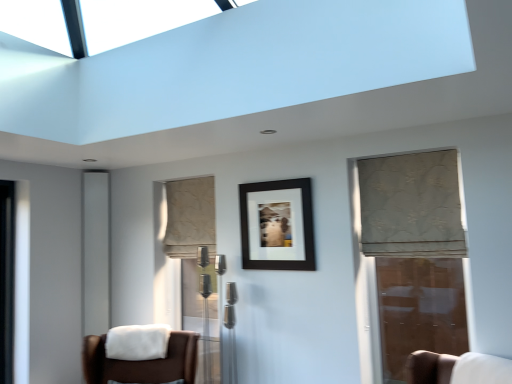
The height and width of the screenshot is (384, 512). What do you see at coordinates (190, 217) in the screenshot?
I see `beige textured curtain at center, arranged as the second curtain when viewed from the right` at bounding box center [190, 217].

I want to click on beige textured curtain at center, the 2th curtain when ordered from front to back, so click(190, 217).

Locate an element on the screen. white soft fabric at lower left is located at coordinates (137, 342).

Based on their positions, is white fabric chair at lower right, the first chair positioned from the right, located to the left or right of beige floral fabric curtain at right, arranged as the 1th curtain when viewed from the front?

white fabric chair at lower right, the first chair positioned from the right, is to the right of beige floral fabric curtain at right, arranged as the 1th curtain when viewed from the front.

Which object is wider, white fabric chair at lower right, which is counted as the 2th chair, starting from the left, or beige floral fabric curtain at right, positioned as the first curtain in right-to-left order?

With larger width is beige floral fabric curtain at right, positioned as the first curtain in right-to-left order.

Considering the positions of points (434, 364) and (422, 243), is point (434, 364) closer to camera compared to point (422, 243)?

Yes, it is in front of point (422, 243).

From their relative heights in the image, would you say white fabric chair at lower right, which is counted as the 2th chair, starting from the left, is taller or shorter than beige floral fabric curtain at right, arranged as the 1th curtain when viewed from the front?

In the image, white fabric chair at lower right, which is counted as the 2th chair, starting from the left, appears to be shorter than beige floral fabric curtain at right, arranged as the 1th curtain when viewed from the front.

Is white soft fabric at lower left at the right side of beige floral fabric curtain at right, positioned as the first curtain in right-to-left order?

Incorrect, white soft fabric at lower left is not on the right side of beige floral fabric curtain at right, positioned as the first curtain in right-to-left order.

Consider the image. Can you confirm if white soft fabric at lower left is thinner than beige floral fabric curtain at right, the 2th curtain when ordered from back to front?

Yes, white soft fabric at lower left is thinner than beige floral fabric curtain at right, the 2th curtain when ordered from back to front.

From the image's perspective, is white soft fabric at lower left below beige floral fabric curtain at right, the second curtain in the left-to-right sequence?

Yes, from the image's perspective, white soft fabric at lower left is below beige floral fabric curtain at right, the second curtain in the left-to-right sequence.

Are white soft fabric at lower left and beige floral fabric curtain at right, the second curtain in the left-to-right sequence, located far from each other?

Yes, white soft fabric at lower left and beige floral fabric curtain at right, the second curtain in the left-to-right sequence, are located far from each other.

Based on the photo, is beige floral fabric curtain at right, positioned as the first curtain in right-to-left order, to the left of gray matte screen door at left from the viewer's perspective?

Incorrect, beige floral fabric curtain at right, positioned as the first curtain in right-to-left order, is not on the left side of gray matte screen door at left.

Can you confirm if beige floral fabric curtain at right, positioned as the first curtain in right-to-left order, is smaller than gray matte screen door at left?

No, beige floral fabric curtain at right, positioned as the first curtain in right-to-left order, is not smaller than gray matte screen door at left.

In the scene shown: Measure the distance between beige floral fabric curtain at right, the second curtain in the left-to-right sequence, and gray matte screen door at left.

beige floral fabric curtain at right, the second curtain in the left-to-right sequence, and gray matte screen door at left are 7.42 feet apart from each other.

Who is shorter, black matte picture frame at center or gray matte screen door at left?

black matte picture frame at center is shorter.

From the image's perspective, is black matte picture frame at center positioned above or below gray matte screen door at left?

From the image's perspective, black matte picture frame at center appears above gray matte screen door at left.

Does black matte picture frame at center appear on the right side of gray matte screen door at left?

Indeed, black matte picture frame at center is positioned on the right side of gray matte screen door at left.

Are black matte picture frame at center and gray matte screen door at left making contact?

No, black matte picture frame at center is not in contact with gray matte screen door at left.

Would you say transparent glass door at right is inside or outside beige floral fabric curtain at right, the second curtain in the left-to-right sequence?

transparent glass door at right is not inside beige floral fabric curtain at right, the second curtain in the left-to-right sequence, it's outside.

You are a GUI agent. You are given a task and a screenshot of the screen. Output one action in this format:
    pyautogui.click(x=<x>, y=<y>)
    Task: Click on the curtain in front of the transparent glass door at right
    The image size is (512, 384).
    Given the screenshot: What is the action you would take?
    pyautogui.click(x=411, y=206)

From the image's perspective, is transparent glass door at right located above or below beige floral fabric curtain at right, positioned as the first curtain in right-to-left order?

Clearly, from the image's perspective, transparent glass door at right is below beige floral fabric curtain at right, positioned as the first curtain in right-to-left order.

Which of these two, transparent glass door at right or beige floral fabric curtain at right, positioned as the first curtain in right-to-left order, is bigger?

beige floral fabric curtain at right, positioned as the first curtain in right-to-left order, is bigger.

Are black matte picture frame at center and transparent glass door at right far apart?

Indeed, black matte picture frame at center is not near transparent glass door at right.

In the scene shown: From the image's perspective, is black matte picture frame at center located beneath transparent glass door at right?

Incorrect, from the image's perspective, black matte picture frame at center is higher than transparent glass door at right.

Based on the photo, is black matte picture frame at center looking in the opposite direction of transparent glass door at right?

black matte picture frame at center does not have its back to transparent glass door at right.

From a real-world perspective, is black matte picture frame at center above or below transparent glass door at right?

black matte picture frame at center is situated higher than transparent glass door at right in the real world.

Between beige textured curtain at center, the first curtain viewed from the left, and transparent glass door at right, which one has larger width?

Wider between the two is beige textured curtain at center, the first curtain viewed from the left.

Which object is closer to the camera, beige textured curtain at center, arranged as the second curtain when viewed from the right, or transparent glass door at right?

Positioned in front is transparent glass door at right.

From a real-world perspective, is beige textured curtain at center, the first curtain viewed from the left, on transparent glass door at right?

Correct, in the physical world, beige textured curtain at center, the first curtain viewed from the left, is higher than transparent glass door at right.

Considering the sizes of objects beige textured curtain at center, the 2th curtain when ordered from front to back, and transparent glass door at right in the image provided, who is bigger, beige textured curtain at center, the 2th curtain when ordered from front to back, or transparent glass door at right?

Bigger between the two is beige textured curtain at center, the 2th curtain when ordered from front to back.

Locate an element on the screen. The width and height of the screenshot is (512, 384). the 1st chair located beneath the beige floral fabric curtain at right, the 2th curtain when ordered from back to front (from a real-world perspective) is located at coordinates (457, 368).

From a real-world perspective, starting from the white soft fabric at lower left, which curtain is the 1st one vertically above it? Please provide its 2D coordinates.

[(411, 206)]

Looking at the image, which one is located closer to beige textured curtain at center, the 2th curtain when ordered from front to back, black matte picture frame at center or brown leather chair at lower left, placed as the 1th chair when sorted from left to right?

Among the two, black matte picture frame at center is located nearer to beige textured curtain at center, the 2th curtain when ordered from front to back.

Based on their spatial positions, is black matte picture frame at center or beige textured curtain at center, the 2th curtain when ordered from front to back, further from gray matte screen door at left?

black matte picture frame at center lies further to gray matte screen door at left than the other object.

Looking at the image, which one is located closer to beige floral fabric curtain at right, the second curtain in the left-to-right sequence, beige textured curtain at center, the 1th curtain viewed from the back, or white soft fabric at lower left?

beige textured curtain at center, the 1th curtain viewed from the back.

Estimate the real-world distances between objects in this image. Which object is closer to transparent glass door at right, gray matte screen door at left or beige floral fabric curtain at right, the 2th curtain when ordered from back to front?

beige floral fabric curtain at right, the 2th curtain when ordered from back to front.

From the image, which object appears to be nearer to white fabric chair at lower right, the first chair positioned from the right, white soft fabric at lower left or black matte picture frame at center?

Among the two, black matte picture frame at center is located nearer to white fabric chair at lower right, the first chair positioned from the right.

Estimate the real-world distances between objects in this image. Which object is further from transparent glass door at right, beige textured curtain at center, arranged as the second curtain when viewed from the right, or brown leather chair at lower left, which ranks as the 2th chair in right-to-left order?

brown leather chair at lower left, which ranks as the 2th chair in right-to-left order.

Estimate the real-world distances between objects in this image. Which object is further from white fabric chair at lower right, which is counted as the 2th chair, starting from the left, transparent glass door at right or brown leather chair at lower left, placed as the 1th chair when sorted from left to right?

The object further to white fabric chair at lower right, which is counted as the 2th chair, starting from the left, is transparent glass door at right.

Considering their positions, is beige floral fabric curtain at right, the second curtain in the left-to-right sequence, positioned further to black matte picture frame at center than gray matte screen door at left?

gray matte screen door at left lies further to black matte picture frame at center than the other object.

Find the location of a particular element. The height and width of the screenshot is (384, 512). picture frame situated between beige textured curtain at center, arranged as the second curtain when viewed from the right, and transparent glass door at right from left to right is located at coordinates (278, 225).

The width and height of the screenshot is (512, 384). I want to click on curtain between beige textured curtain at center, arranged as the second curtain when viewed from the right, and transparent glass door at right from left to right, so [x=411, y=206].

The height and width of the screenshot is (384, 512). I want to click on picture frame located between white soft fabric at lower left and beige floral fabric curtain at right, positioned as the first curtain in right-to-left order, in the left-right direction, so click(278, 225).

I want to click on blanket located between brown leather chair at lower left, placed as the 1th chair when sorted from left to right, and gray matte screen door at left in the depth direction, so click(137, 342).